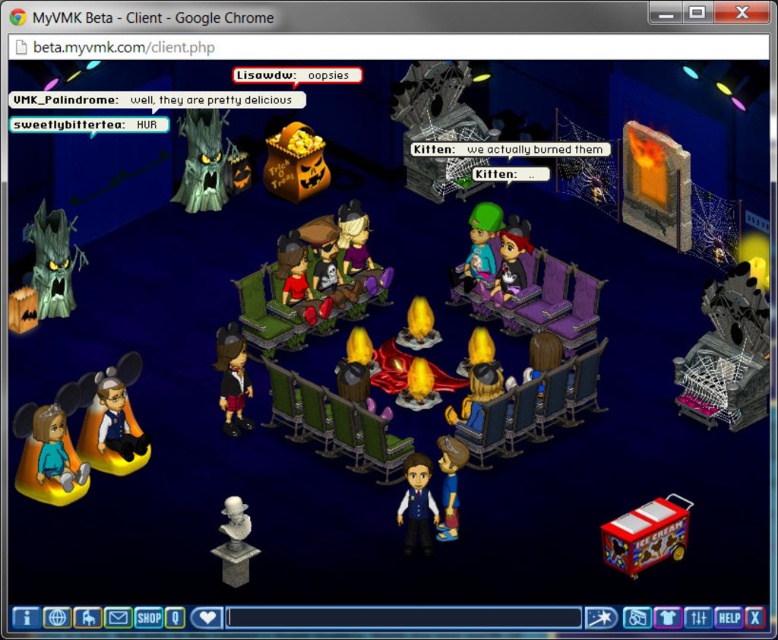
You are an avatar in the MyVMK Beta game, and you want to interact with the matte purple plush at center. The game requires you to be within 20 feet to interact. Can you reach it from your current position?

The matte purple plush at center is 18.32 feet away from the camera, so yes, you can reach it since it is within the 20 feet interaction range.

You are navigating through the Halloween event area in MyVMK Beta. You need to move from your current position to a specific location marked by point (377, 268) and then to point (491, 257). Which point should you reach first to ensure you are moving towards the closer one first?

You should reach point (377, 268) first because it is closer to the viewer than point (491, 257), so moving to it first ensures you are going towards the nearer location.

You are a character in the game and want to sit down. You see the green plush couch at center and the white marble bust at lower center. Which one can you sit on?

The green plush couch at center can be sat on because it is wider than the white marble bust at lower center, which is likely too small or not designed for sitting.